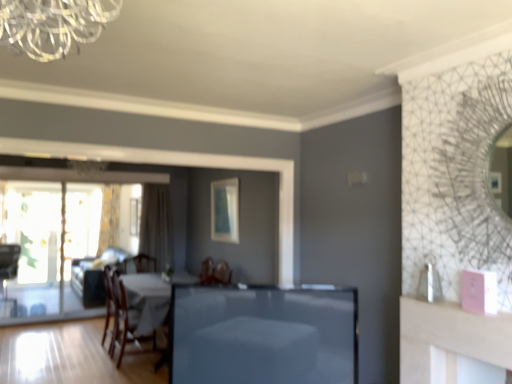
Question: Can you confirm if smooth glass table at center is thinner than wooden chair at left, marked as the first chair in a left-to-right arrangement?

Choices:
 (A) yes
 (B) no

Answer: (A)

Question: Is smooth glass table at center at the left side of wooden chair at left, marked as the first chair in a left-to-right arrangement?

Choices:
 (A) no
 (B) yes

Answer: (A)

Question: Is smooth glass table at center taller than wooden chair at left, which appears as the 1th chair when viewed from the back?

Choices:
 (A) no
 (B) yes

Answer: (A)

Question: Can wooden chair at left, marked as the first chair in a left-to-right arrangement, be found inside smooth glass table at center?

Choices:
 (A) no
 (B) yes

Answer: (A)

Question: Is smooth glass table at center not close to wooden chair at left, arranged as the second chair when viewed from the right?

Choices:
 (A) yes
 (B) no

Answer: (A)

Question: Is smooth glass table at center not inside wooden chair at left, arranged as the second chair when viewed from the right?

Choices:
 (A) yes
 (B) no

Answer: (A)

Question: From a real-world perspective, is wooden chair at lower left, positioned as the 1th chair in front-to-back order, positioned over beige fabric curtain at left, placed as the first curtain when sorted from right to left, based on gravity?

Choices:
 (A) yes
 (B) no

Answer: (B)

Question: Is wooden chair at lower left, marked as the 2th chair in a left-to-right arrangement, bigger than beige fabric curtain at left, arranged as the 2th curtain when viewed from the left?

Choices:
 (A) no
 (B) yes

Answer: (B)

Question: Could beige fabric curtain at left, which is the 2th curtain from back to front, be considered to be inside wooden chair at lower left, the first chair positioned from the right?

Choices:
 (A) yes
 (B) no

Answer: (B)

Question: Is wooden chair at lower left, marked as the 2th chair in a left-to-right arrangement, behind beige fabric curtain at left, placed as the first curtain when sorted from right to left?

Choices:
 (A) yes
 (B) no

Answer: (B)

Question: Considering the relative sizes of wooden chair at lower left, positioned as the 2th chair in back-to-front order, and beige fabric curtain at left, which is the 2th curtain from back to front, in the image provided, is wooden chair at lower left, positioned as the 2th chair in back-to-front order, smaller than beige fabric curtain at left, which is the 2th curtain from back to front,?

Choices:
 (A) no
 (B) yes

Answer: (A)

Question: From the image's perspective, is wooden chair at lower left, marked as the 2th chair in a left-to-right arrangement, over beige fabric curtain at left, which is the 2th curtain from back to front?

Choices:
 (A) yes
 (B) no

Answer: (B)

Question: From a real-world perspective, is beige fabric curtain at left, which is counted as the 1th curtain, starting from the front, positioned under smooth glass table at center based on gravity?

Choices:
 (A) yes
 (B) no

Answer: (B)